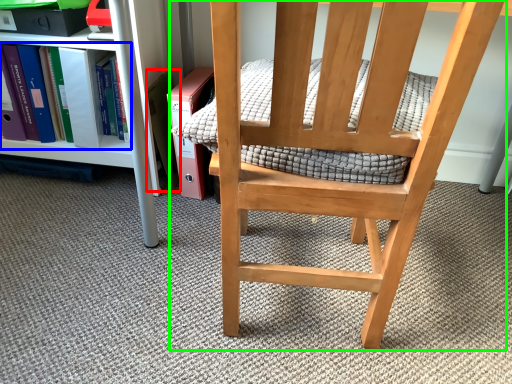
Question: Based on their relative distances, which object is nearer to paperback book (highlighted by a red box)? Choose from book (highlighted by a blue box) and chair (highlighted by a green box).

Choices:
 (A) book
 (B) chair

Answer: (A)